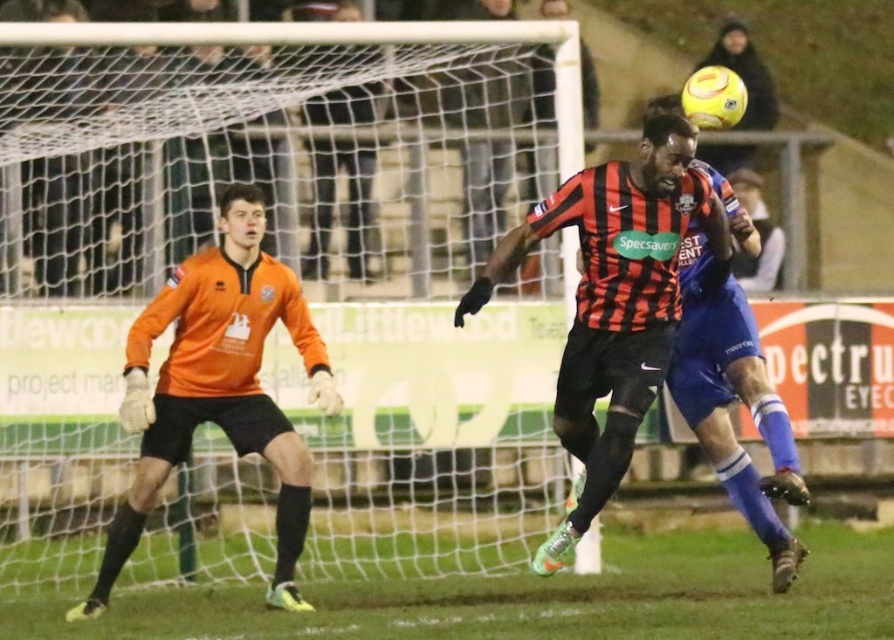
Question: Is red and black striped jersey at center closer to the viewer compared to orange jersey at left?

Choices:
 (A) no
 (B) yes

Answer: (B)

Question: Which point is closer to the camera taking this photo?

Choices:
 (A) (250, 445)
 (B) (91, 481)

Answer: (A)

Question: In this image, where is matte orange goalkeeper jersey at left located relative to red and black striped jersey at center?

Choices:
 (A) above
 (B) below

Answer: (A)

Question: Does matte orange goalkeeper jersey at left have a greater width compared to red and black striped jersey at center?

Choices:
 (A) yes
 (B) no

Answer: (A)

Question: Which of the following is the closest to the observer?

Choices:
 (A) (422, 460)
 (B) (609, 241)
 (C) (230, 364)

Answer: (B)

Question: Which point is farther to the camera?

Choices:
 (A) matte orange goalkeeper jersey at left
 (B) orange jersey at left

Answer: (A)